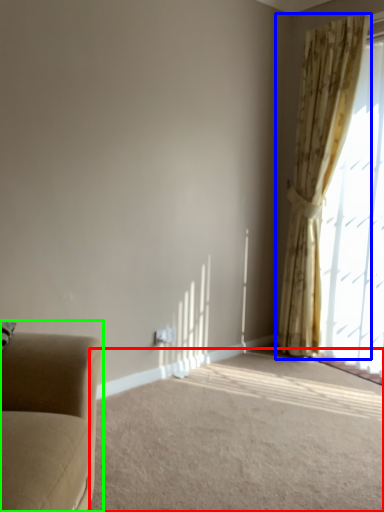
Question: Which object is the closest to the plain (highlighted by a red box)? Choose among these: curtain (highlighted by a blue box) or studio couch (highlighted by a green box).

Choices:
 (A) curtain
 (B) studio couch

Answer: (B)